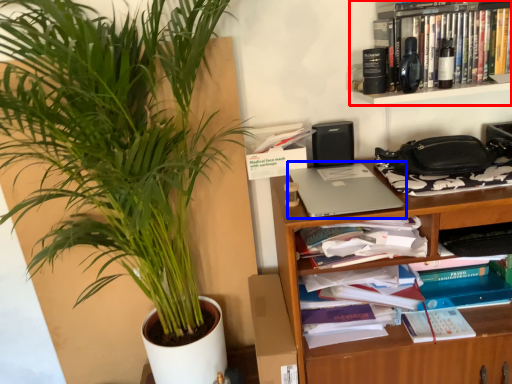
Question: Which point is further to the camera, shelf (highlighted by a red box) or laptop (highlighted by a blue box)?

Choices:
 (A) shelf
 (B) laptop

Answer: (A)